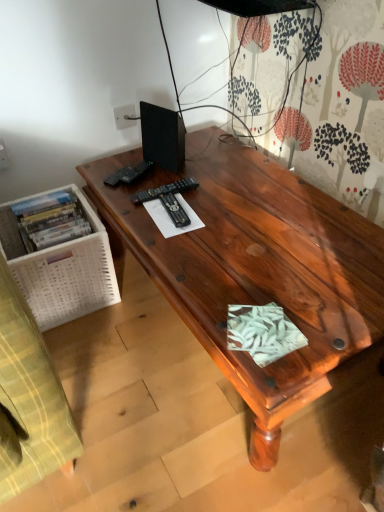
Where is `free space in front of black plastic remote control at center, acting as the second remote control starting from the front`? Image resolution: width=384 pixels, height=512 pixels. free space in front of black plastic remote control at center, acting as the second remote control starting from the front is located at coordinates (173, 230).